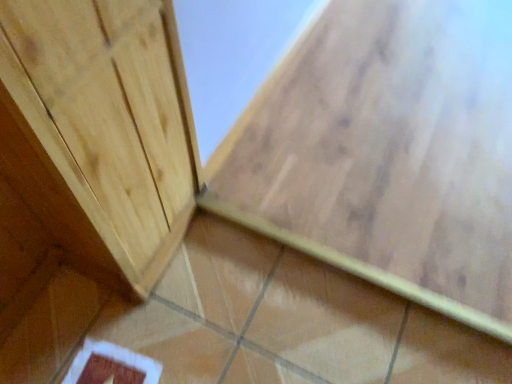
Question: Is brown glossy tile at center, which is the second ceramic tile in bottom-to-top order, bigger or smaller than brown glossy tile at lower center, which is the first ceramic tile from bottom to top?

Choices:
 (A) small
 (B) big

Answer: (B)

Question: From a real-world perspective, relative to brown glossy tile at lower center, the second ceramic tile positioned from the top, is brown glossy tile at center, which is the second ceramic tile in bottom-to-top order, vertically above or below?

Choices:
 (A) below
 (B) above

Answer: (B)

Question: Is brown glossy tile at center, which is the 1th ceramic tile in top-to-bottom order, in front of or behind brown glossy tile at lower center, which is the first ceramic tile from bottom to top, in the image?

Choices:
 (A) behind
 (B) front

Answer: (A)

Question: Relative to brown glossy tile at center, which is the second ceramic tile in bottom-to-top order, is brown glossy tile at lower center, which is the first ceramic tile from bottom to top, in front or behind?

Choices:
 (A) behind
 (B) front

Answer: (B)

Question: From a real-world perspective, relative to brown glossy tile at center, which is the 1th ceramic tile in top-to-bottom order, is brown glossy tile at lower center, the second ceramic tile positioned from the top, vertically above or below?

Choices:
 (A) above
 (B) below

Answer: (B)

Question: From the image's perspective, is brown glossy tile at lower center, which is the first ceramic tile from bottom to top, positioned above or below brown glossy tile at center, which is the second ceramic tile in bottom-to-top order?

Choices:
 (A) above
 (B) below

Answer: (B)

Question: Choose the correct answer: Is brown glossy tile at lower center, which is the first ceramic tile from bottom to top, inside brown glossy tile at center, which is the 1th ceramic tile in top-to-bottom order, or outside it?

Choices:
 (A) outside
 (B) inside

Answer: (A)